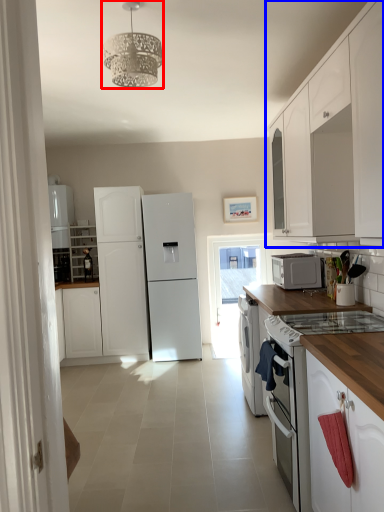
Question: Among these objects, which one is farthest to the camera, light fixture (highlighted by a red box) or cabinetry (highlighted by a blue box)?

Choices:
 (A) light fixture
 (B) cabinetry

Answer: (B)